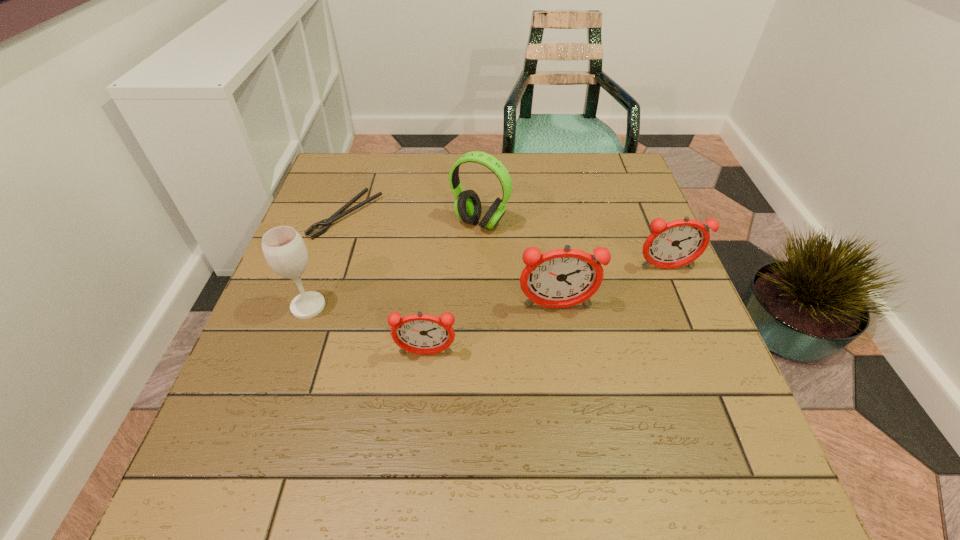
Locate an element on the screen. This screenshot has height=540, width=960. vacant point at the far edge is located at coordinates (415, 159).

Image resolution: width=960 pixels, height=540 pixels. What are the coordinates of `free spot at the left edge of the desktop` in the screenshot? It's located at (333, 319).

At what (x,y) coordinates should I click in order to perform the action: click on vacant space at the right edge of the desktop. Please return your answer as a coordinate pair (x, y). Image resolution: width=960 pixels, height=540 pixels. Looking at the image, I should click on click(685, 350).

Where is `vacant space at the far left corner of the desktop`? This screenshot has width=960, height=540. vacant space at the far left corner of the desktop is located at coordinates (361, 153).

In order to click on free location at the far right corner in this screenshot , I will do `click(609, 194)`.

In the image, there is a desktop. Where is `vacant space at the near right corner`? vacant space at the near right corner is located at coordinates (665, 411).

The height and width of the screenshot is (540, 960). I want to click on free spot between the shortest object and the second nearest alarm clock, so click(452, 260).

Locate an element on the screen. Image resolution: width=960 pixels, height=540 pixels. free area in between the shortest object and the headset is located at coordinates (414, 218).

I want to click on vacant point located between the second farthest alarm clock and the wineglass, so click(433, 307).

Identify the location of free space between the tongs and the wineglass. (327, 260).